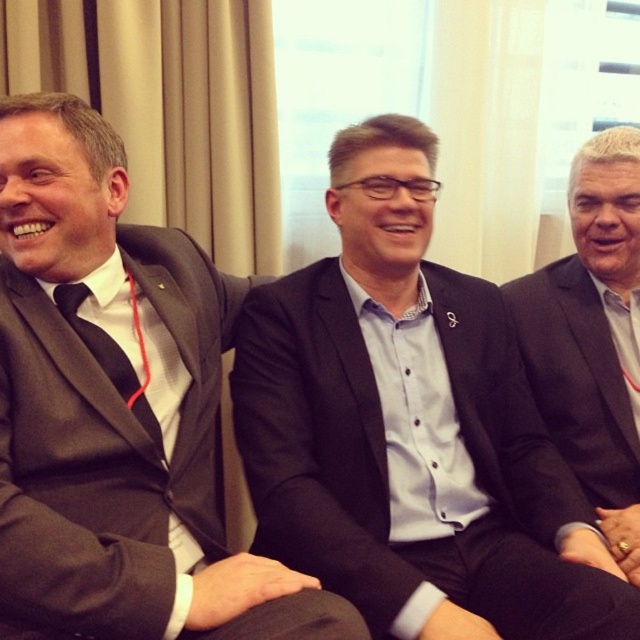
Based on the scene description, which object is taller between the matte black suit at left and the black satin tie at left?

The matte black suit at left is much taller than the black satin tie at left.

You are a photographer preparing to take a group photo of the three men. You need to ensure that the matte black suit at left and the black satin tie at left are both visible in the frame. Given their sizes, which one might require more careful positioning to avoid being obscured?

The matte black suit at left has a larger size compared to the black satin tie at left, so the matte black suit at left might require more careful positioning to avoid being obscured.

Looking at this image, you are a photographer setting up a tripod to capture a group photo of the matte black suit at left and the dark gray suit at right. The tripod has a width requirement of 1.2 meters between subjects. Based on their positions, can they stand close enough to fit within this width?

The matte black suit at left might be wider than dark gray suit at right, but the exact width isn t specified. Without knowing their actual widths, it s uncertain if they can fit within the 1.2 meter requirement.